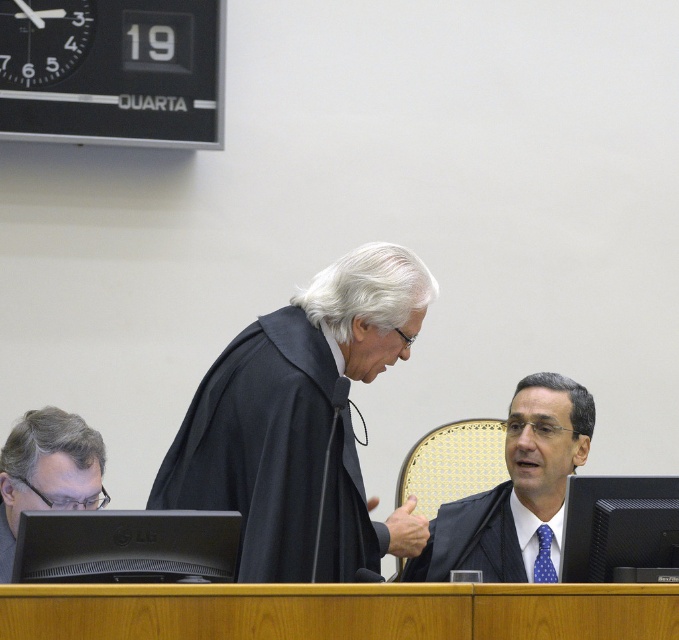
Is gray matte glasses at lower left wider than dark blue textured robe at center?

No, gray matte glasses at lower left is not wider than dark blue textured robe at center.

Who is more forward, (x=24, y=502) or (x=416, y=561)?

Positioned in front is point (x=24, y=502).

Does point (55, 420) come closer to viewer compared to point (433, 577)?

Yes, point (55, 420) is in front of point (433, 577).

Find the location of a particular element. The width and height of the screenshot is (679, 640). gray matte glasses at lower left is located at coordinates (45, 472).

Does black matte robe at center have a smaller size compared to gray matte glasses at lower left?

No.

Which is in front, point (342, 465) or point (16, 531)?

Point (342, 465) is more forward.

Does point (249, 384) come behind point (56, 420)?

No, (249, 384) is closer to viewer.

Where is `black matte robe at center`? The width and height of the screenshot is (679, 640). black matte robe at center is located at coordinates pyautogui.click(x=274, y=456).

Is point (327, 547) more distant than point (495, 550)?

No.

Between black matte robe at center and black glossy suit at center, which one is positioned lower?

black glossy suit at center

This screenshot has width=679, height=640. In order to click on black matte robe at center in this screenshot , I will do click(274, 456).

Locate an element on the screen. Image resolution: width=679 pixels, height=640 pixels. black matte robe at center is located at coordinates (274, 456).